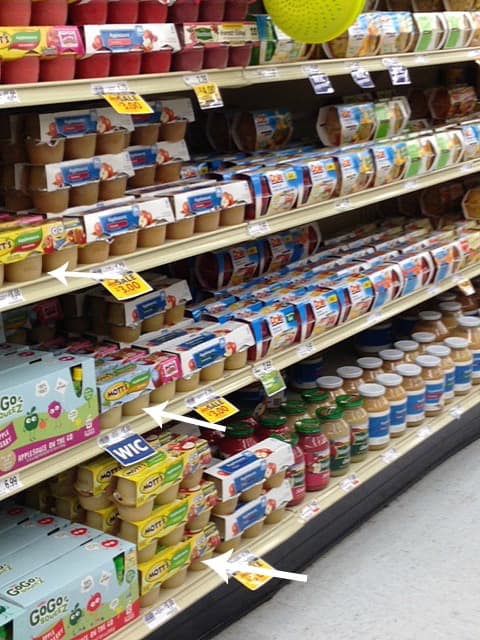
Where is `rows of shelves`? This screenshot has height=640, width=480. rows of shelves is located at coordinates (332, 495), (66, 466), (38, 294), (40, 90).